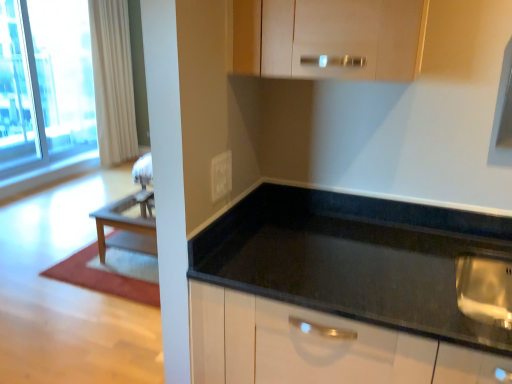
Question: Considering the relative sizes of white textured curtain at left and black granite countertop at center in the image provided, is white textured curtain at left taller than black granite countertop at center?

Choices:
 (A) yes
 (B) no

Answer: (A)

Question: Is white textured curtain at left further to the viewer compared to black granite countertop at center?

Choices:
 (A) no
 (B) yes

Answer: (B)

Question: Does white textured curtain at left have a lesser width compared to black granite countertop at center?

Choices:
 (A) no
 (B) yes

Answer: (B)

Question: Considering the relative positions of white textured curtain at left and black granite countertop at center in the image provided, is white textured curtain at left in front of black granite countertop at center?

Choices:
 (A) yes
 (B) no

Answer: (B)

Question: Is black granite countertop at center inside white textured curtain at left?

Choices:
 (A) no
 (B) yes

Answer: (A)

Question: From a real-world perspective, is white textured curtain at left physically above black granite countertop at center?

Choices:
 (A) no
 (B) yes

Answer: (B)

Question: Is black granite countertop at center located outside white glossy electric outlet at center?

Choices:
 (A) no
 (B) yes

Answer: (B)

Question: Is black granite countertop at center at the left side of white glossy electric outlet at center?

Choices:
 (A) yes
 (B) no

Answer: (B)

Question: Is black granite countertop at center to the right of white glossy electric outlet at center from the viewer's perspective?

Choices:
 (A) no
 (B) yes

Answer: (B)

Question: Can you confirm if black granite countertop at center is thinner than white glossy electric outlet at center?

Choices:
 (A) no
 (B) yes

Answer: (A)

Question: Is white glossy electric outlet at center a part of black granite countertop at center?

Choices:
 (A) no
 (B) yes

Answer: (A)

Question: From a real-world perspective, is black granite countertop at center on white glossy electric outlet at center?

Choices:
 (A) no
 (B) yes

Answer: (A)

Question: Is transparent glass window at upper left turned away from white glossy electric outlet at center?

Choices:
 (A) no
 (B) yes

Answer: (A)